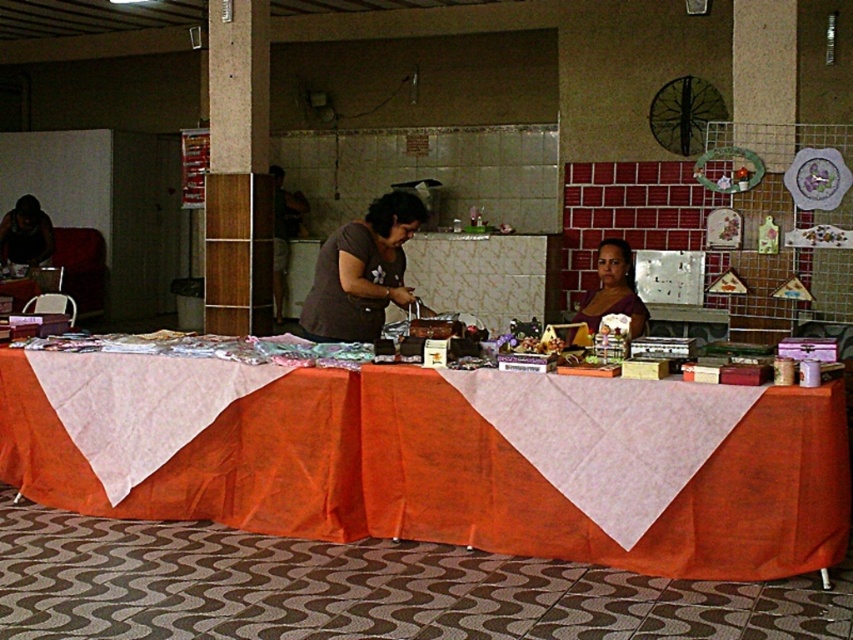
Question: Which is nearer to the orange fabric table at center?

Choices:
 (A) dark gray fabric at center
 (B) matte brown dress at center

Answer: (A)

Question: Where is orange fabric table at center located in relation to matte brown dress at center in the image?

Choices:
 (A) right
 (B) left

Answer: (B)

Question: Estimate the real-world distances between objects in this image. Which object is closer to the orange fabric table at center?

Choices:
 (A) dark gray fabric at center
 (B) matte brown dress at center
 (C) matte black laptop at left

Answer: (A)

Question: Estimate the real-world distances between objects in this image. Which object is closer to the orange fabric table at center?

Choices:
 (A) matte brown dress at center
 (B) matte black laptop at left

Answer: (A)

Question: Is matte brown dress at center thinner than matte black laptop at left?

Choices:
 (A) no
 (B) yes

Answer: (B)

Question: Is orange fabric table at center bigger than matte black laptop at left?

Choices:
 (A) no
 (B) yes

Answer: (B)